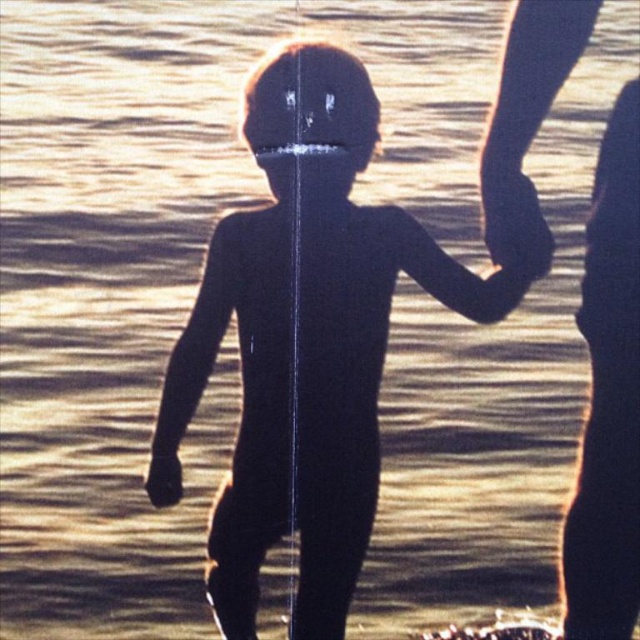
Can you confirm if black matte hand at right is positioned to the left of black matte hand at lower left?

Incorrect, black matte hand at right is not on the left side of black matte hand at lower left.

What do you see at coordinates (515, 225) in the screenshot?
I see `black matte hand at right` at bounding box center [515, 225].

Find the location of `black matte hand at right`. black matte hand at right is located at coordinates (515, 225).

Is black matte skin at right positioned before black matte hand at right?

Yes, it is.

What do you see at coordinates (609, 396) in the screenshot? I see `black matte skin at right` at bounding box center [609, 396].

What do you see at coordinates (609, 396) in the screenshot? Image resolution: width=640 pixels, height=640 pixels. I see `black matte skin at right` at bounding box center [609, 396].

You are a GUI agent. You are given a task and a screenshot of the screen. Output one action in this format:
    pyautogui.click(x=<x>, y=<y>)
    Task: Click on the black matte skin at right
    
    Given the screenshot: What is the action you would take?
    pyautogui.click(x=609, y=396)

Can you confirm if black matte skin at right is shorter than black matte hand at lower left?

No, black matte skin at right is not shorter than black matte hand at lower left.

Who is more distant from viewer, (616, 381) or (161, 486)?

The point (616, 381) is more distant.

In order to click on black matte skin at right in this screenshot , I will do `click(609, 396)`.